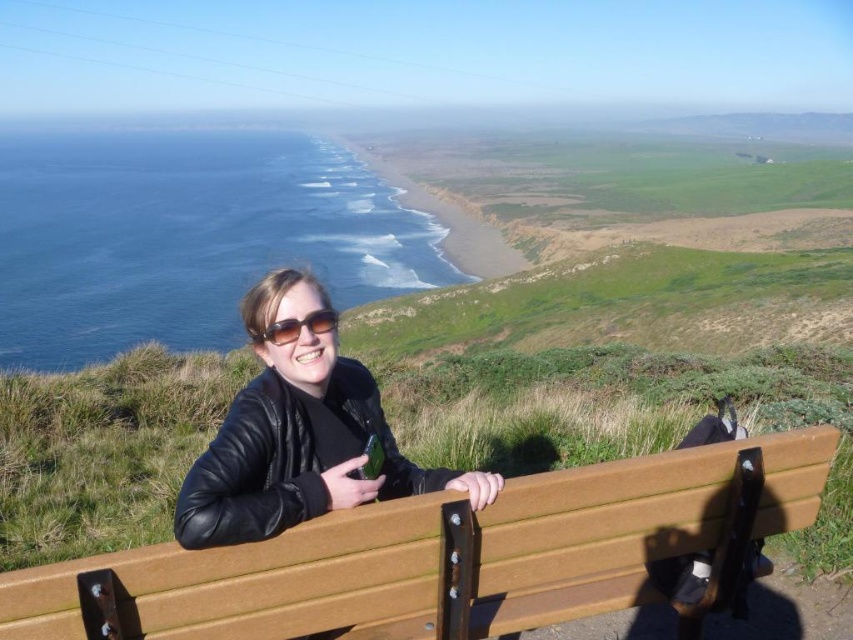
Question: Is green grassy shoreline at center thinner than black matte sunglasses at center?

Choices:
 (A) yes
 (B) no

Answer: (B)

Question: Estimate the real-world distances between objects in this image. Which object is closer to the wooden bench at center?

Choices:
 (A) black matte sunglasses at center
 (B) green grassy shoreline at center

Answer: (A)

Question: Which of the following is the farthest from the observer?

Choices:
 (A) (619, 461)
 (B) (469, 240)

Answer: (B)

Question: Observing the image, what is the correct spatial positioning of wooden bench at center in reference to green grassy shoreline at center?

Choices:
 (A) right
 (B) left

Answer: (A)

Question: Among these points, which one is farthest from the camera?

Choices:
 (A) (288, 332)
 (B) (416, 556)
 (C) (514, 262)

Answer: (C)

Question: Considering the relative positions of wooden bench at center and green grassy shoreline at center in the image provided, where is wooden bench at center located with respect to green grassy shoreline at center?

Choices:
 (A) below
 (B) above

Answer: (A)